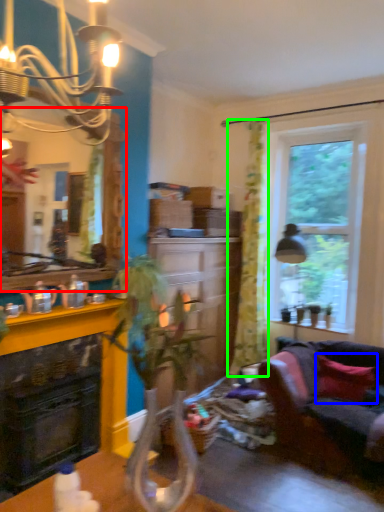
Question: Which object is the farthest from mirror (highlighted by a red box)? Choose among these: pillow (highlighted by a blue box) or curtain (highlighted by a green box).

Choices:
 (A) pillow
 (B) curtain

Answer: (A)